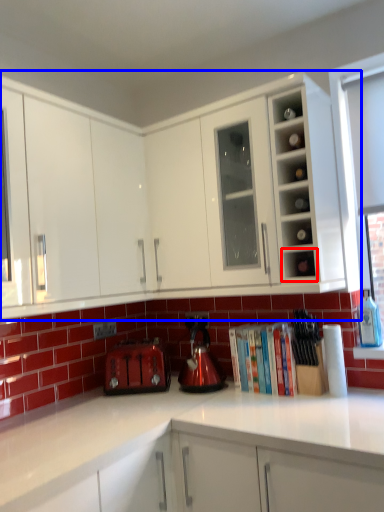
Question: Which object is further to the camera taking this photo, shelf (highlighted by a red box) or cabinetry (highlighted by a blue box)?

Choices:
 (A) shelf
 (B) cabinetry

Answer: (A)